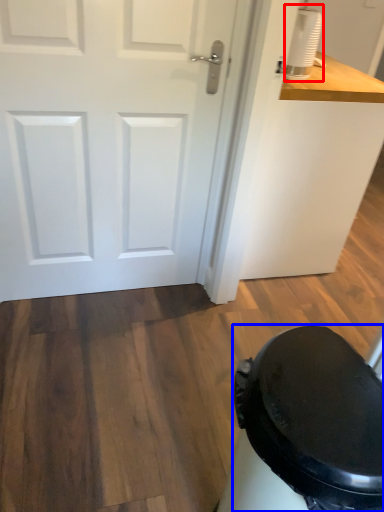
Question: Among these objects, which one is nearest to the camera, appliance (highlighted by a red box) or potty (highlighted by a blue box)?

Choices:
 (A) appliance
 (B) potty

Answer: (B)